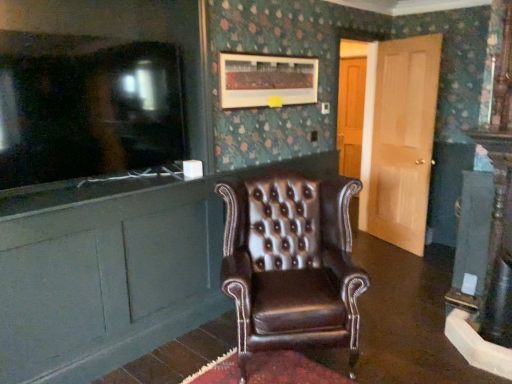
Question: Does brown leather wingback chair at center have a smaller size compared to brown leather cabinet at left?

Choices:
 (A) yes
 (B) no

Answer: (B)

Question: From the image's perspective, does brown leather wingback chair at center appear lower than brown leather cabinet at left?

Choices:
 (A) no
 (B) yes

Answer: (B)

Question: Is brown leather cabinet at left at the back of brown leather wingback chair at center?

Choices:
 (A) yes
 (B) no

Answer: (A)

Question: From a real-world perspective, is brown leather wingback chair at center located higher than brown leather cabinet at left?

Choices:
 (A) yes
 (B) no

Answer: (B)

Question: Is brown leather wingback chair at center located outside brown leather cabinet at left?

Choices:
 (A) yes
 (B) no

Answer: (A)

Question: Is matte black television at left taller or shorter than light brown wood door at right?

Choices:
 (A) tall
 (B) short

Answer: (B)

Question: Looking at their shapes, would you say matte black television at left is wider or thinner than light brown wood door at right?

Choices:
 (A) thin
 (B) wide

Answer: (A)

Question: Is matte black television at left inside the boundaries of light brown wood door at right, or outside?

Choices:
 (A) outside
 (B) inside

Answer: (A)

Question: Is matte black television at left bigger or smaller than light brown wood door at right?

Choices:
 (A) big
 (B) small

Answer: (B)

Question: Considering the positions of point (314, 238) and point (380, 79), is point (314, 238) closer or farther from the camera than point (380, 79)?

Choices:
 (A) closer
 (B) farther

Answer: (A)

Question: In terms of width, does brown leather wingback chair at center look wider or thinner when compared to light brown wood door at right?

Choices:
 (A) wide
 (B) thin

Answer: (A)

Question: From their relative heights in the image, would you say brown leather wingback chair at center is taller or shorter than light brown wood door at right?

Choices:
 (A) tall
 (B) short

Answer: (B)

Question: Considering their positions, is brown leather wingback chair at center located in front of or behind light brown wood door at right?

Choices:
 (A) behind
 (B) front

Answer: (B)

Question: From the image's perspective, relative to brown leather cabinet at left, is light brown wood door at right above or below?

Choices:
 (A) below
 (B) above

Answer: (B)

Question: In terms of width, does light brown wood door at right look wider or thinner when compared to brown leather cabinet at left?

Choices:
 (A) wide
 (B) thin

Answer: (A)